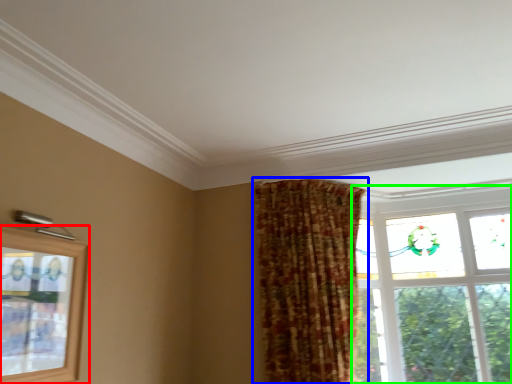
Question: Considering the real-world distances, which object is farthest from window (highlighted by a red box)? curtain (highlighted by a blue box) or window (highlighted by a green box)?

Choices:
 (A) curtain
 (B) window

Answer: (B)